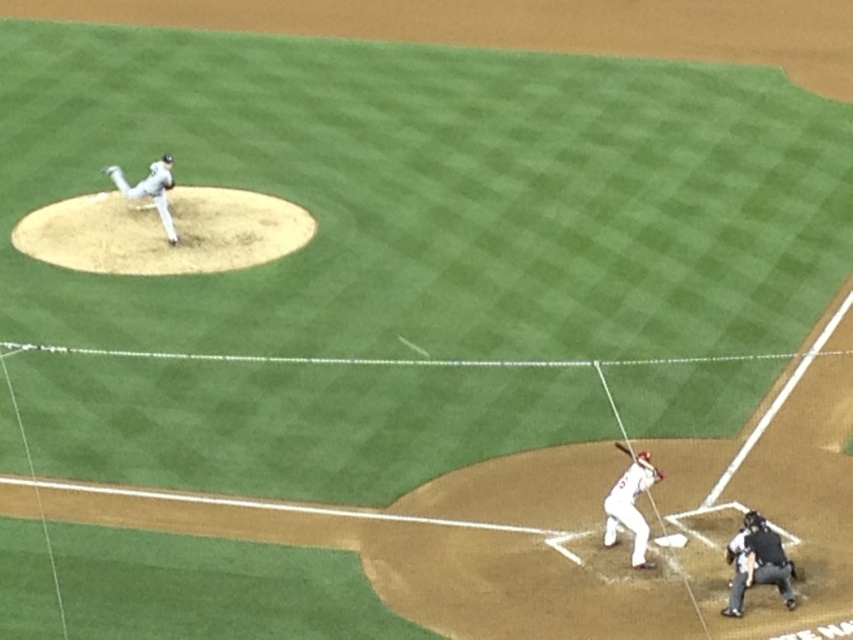
Is brown dirt mound at upper left wider than brown leather glove at lower right?

Correct, the width of brown dirt mound at upper left exceeds that of brown leather glove at lower right.

From the picture: Is brown dirt mound at upper left taller than brown leather glove at lower right?

Correct, brown dirt mound at upper left is much taller as brown leather glove at lower right.

Between point (132, 243) and point (657, 470), which one is positioned in front?

Point (657, 470) is in front.

Locate an element on the screen. This screenshot has height=640, width=853. brown dirt mound at upper left is located at coordinates (163, 230).

Can you confirm if white matte baseball bat at lower right is bigger than white matte baseball pitcher at upper left?

Incorrect, white matte baseball bat at lower right is not larger than white matte baseball pitcher at upper left.

Is the position of white matte baseball bat at lower right more distant than that of white matte baseball pitcher at upper left?

No, it is not.

Identify the location of white matte baseball bat at lower right. (630, 508).

Is the position of brown dirt mound at upper left more distant than that of black leather umpire at lower right?

That is True.

Measure the distance from brown dirt mound at upper left to black leather umpire at lower right.

The distance of brown dirt mound at upper left from black leather umpire at lower right is 38.05 feet.

Is point (280, 216) positioned before point (759, 579)?

No, it is behind (759, 579).

The height and width of the screenshot is (640, 853). I want to click on brown dirt mound at upper left, so click(x=163, y=230).